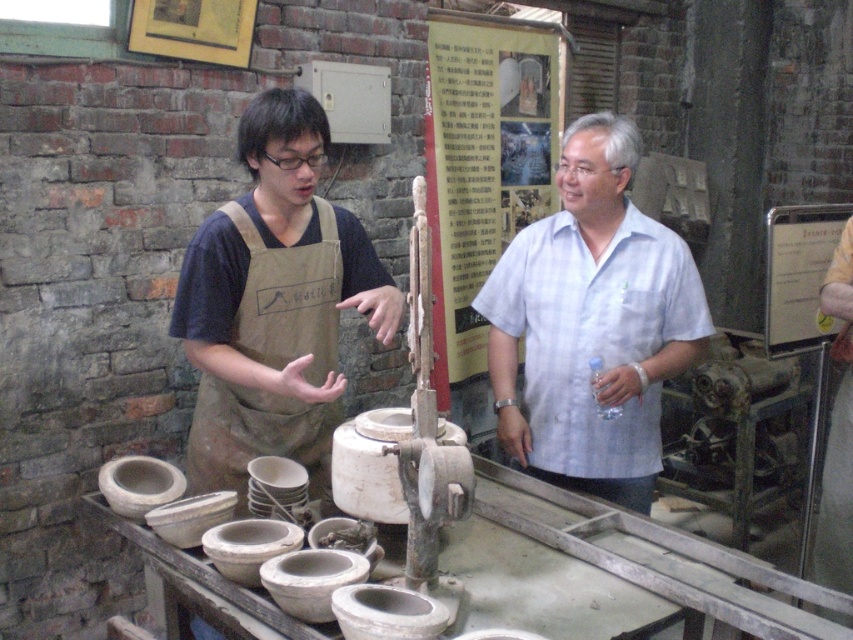
Question: Does white cotton shirt at center have a smaller size compared to brown canvas apron at left?

Choices:
 (A) no
 (B) yes

Answer: (B)

Question: Among these objects, which one is nearest to the camera?

Choices:
 (A) brown canvas apron at left
 (B) white cotton shirt at center

Answer: (A)

Question: Is white cotton shirt at center above brown canvas apron at left?

Choices:
 (A) no
 (B) yes

Answer: (A)

Question: Considering the relative positions of white cotton shirt at center and brown canvas apron at left in the image provided, where is white cotton shirt at center located with respect to brown canvas apron at left?

Choices:
 (A) left
 (B) right

Answer: (B)